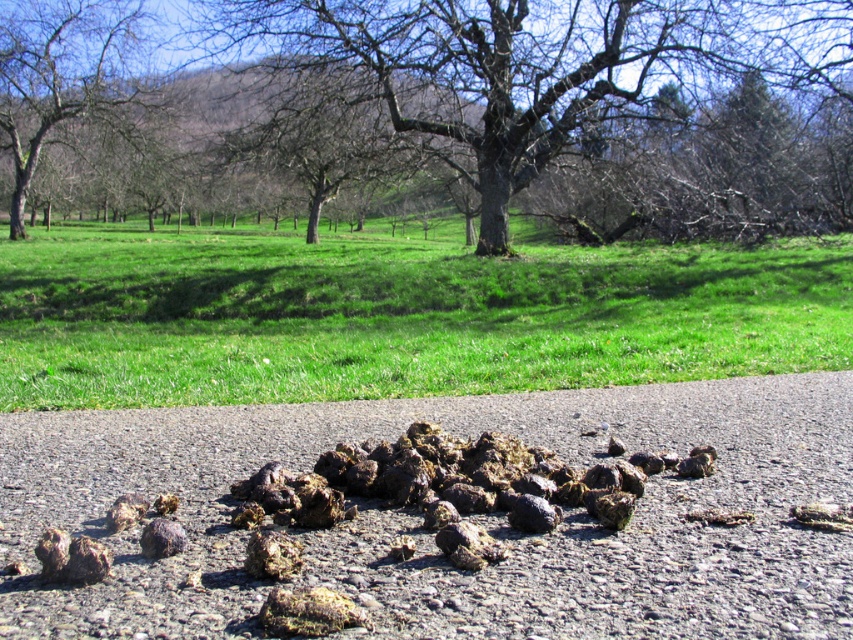
You are standing at the point marked by the coordinates point (57,76) in the rural outdoor scene. What object is located at your current position?

The point (57,76) corresponds to the location of the bare wood tree at upper left.

You are a gardener planning to plant a new flower bed between the smooth bark tree at center and the rusty metallic rock at lower left. Based on their widths, which object requires more space around it for the flower bed?

The smooth bark tree at center might require more space around it for the flower bed since it might be wider than the rusty metallic rock at lower left according to the description.

You are a gardener who wants to place a small decorative garden gnome between the green grass at lower center and the rusty metallic rock at lower left. Based on their heights, which object should the gnome be placed closer to?

The green grass at lower center is taller than the rusty metallic rock at lower left, so the gnome should be placed closer to the rusty metallic rock at lower left to ensure it is visible among the shorter object.